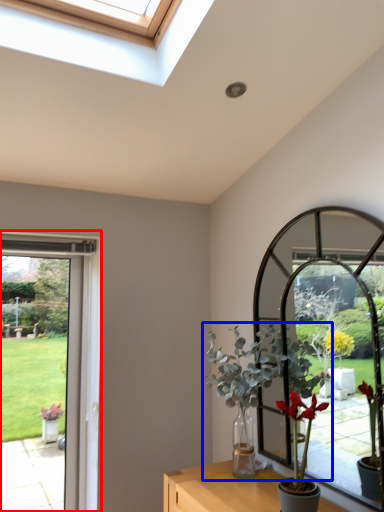
Question: Which point is further to the camera, window frame (highlighted by a red box) or houseplant (highlighted by a blue box)?

Choices:
 (A) window frame
 (B) houseplant

Answer: (A)